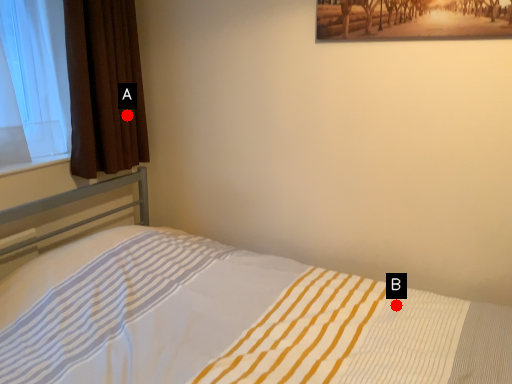
Question: Two points are circled on the image, labeled by A and B beside each circle. Which point is closer to the camera taking this photo?

Choices:
 (A) A is closer
 (B) B is closer

Answer: (B)